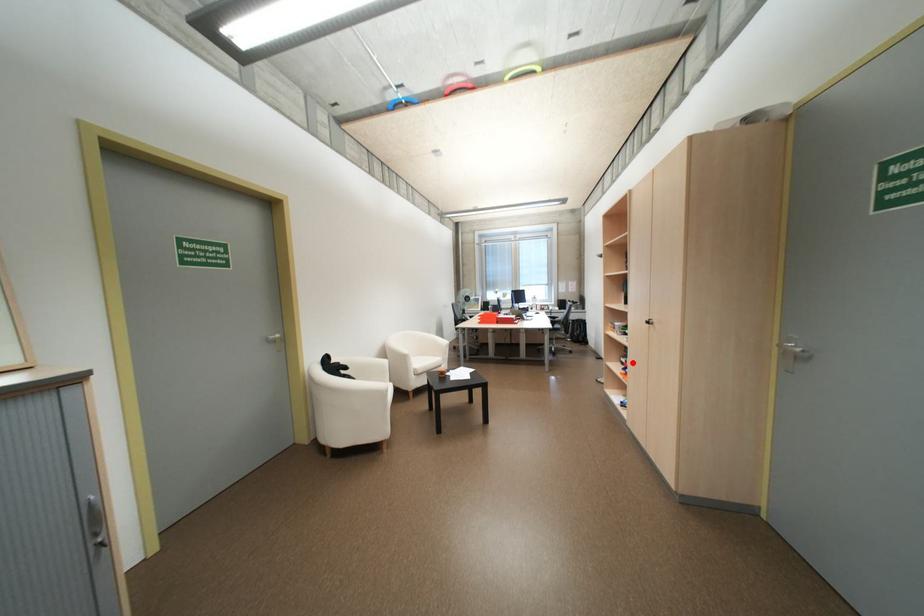
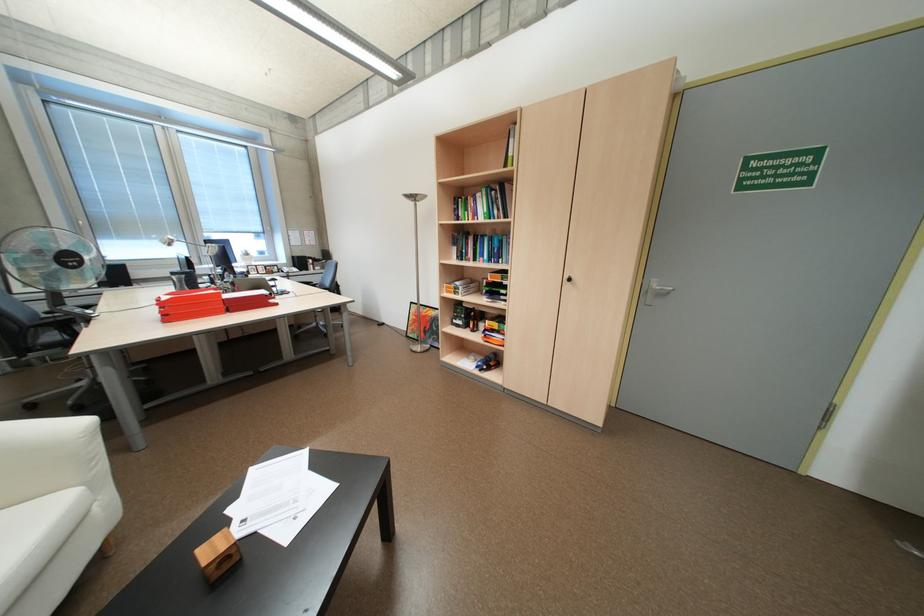
The point at the highlighted location is marked in the first image. Where is the corresponding point in the second image?

(468, 325)